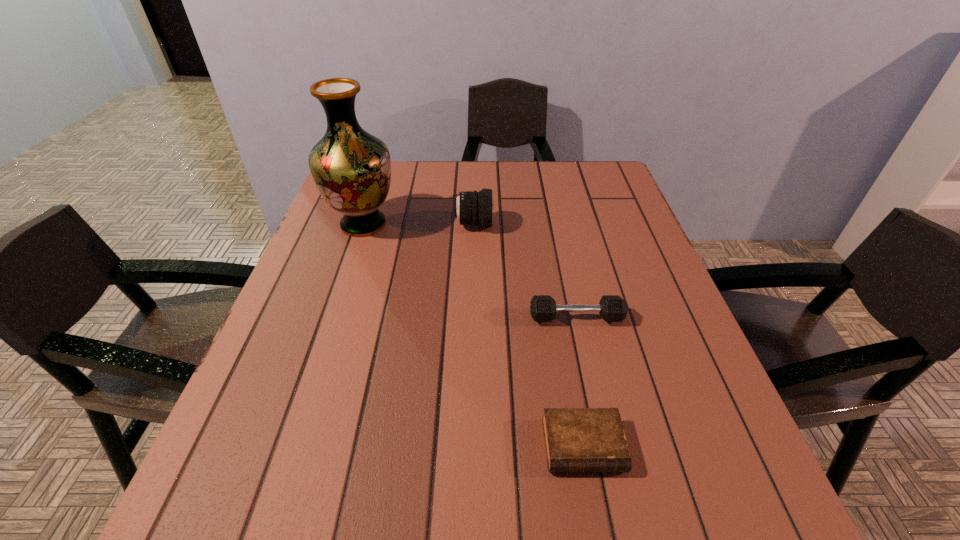
You are a GUI agent. You are given a task and a screenshot of the screen. Output one action in this format:
    pyautogui.click(x=<x>, y=<y>)
    Task: Click on the vacant space located on the front of the dumbbell
    
    Given the screenshot: What is the action you would take?
    pyautogui.click(x=589, y=380)

You are a GUI agent. You are given a task and a screenshot of the screen. Output one action in this format:
    pyautogui.click(x=<x>, y=<y>)
    Task: Click on the vacant space situated 0.070m on the spine side of the diary
    Image resolution: width=960 pixels, height=540 pixels.
    Given the screenshot: What is the action you would take?
    pyautogui.click(x=597, y=525)

Where is `object situated at the left edge`? This screenshot has width=960, height=540. object situated at the left edge is located at coordinates (351, 168).

Where is `object at the right edge`? Image resolution: width=960 pixels, height=540 pixels. object at the right edge is located at coordinates (612, 308).

The image size is (960, 540). In the image, there is a desktop. In order to click on vacant area at the far edge in this screenshot , I will do `click(491, 180)`.

Find the location of a particular element. The height and width of the screenshot is (540, 960). free space at the near edge of the desktop is located at coordinates (540, 507).

In order to click on vacant space at the left edge of the desktop in this screenshot , I will do `click(335, 259)`.

In the image, there is a desktop. Identify the location of vacant area at the right edge. The image size is (960, 540). (671, 310).

In the image, there is a desktop. Identify the location of vacant space at the far right corner. The width and height of the screenshot is (960, 540). (576, 195).

You are a GUI agent. You are given a task and a screenshot of the screen. Output one action in this format:
    pyautogui.click(x=<x>, y=<y>)
    Task: Click on the vacant space that's between the second tallest object and the shortest object
    The image size is (960, 540).
    Given the screenshot: What is the action you would take?
    pyautogui.click(x=528, y=335)